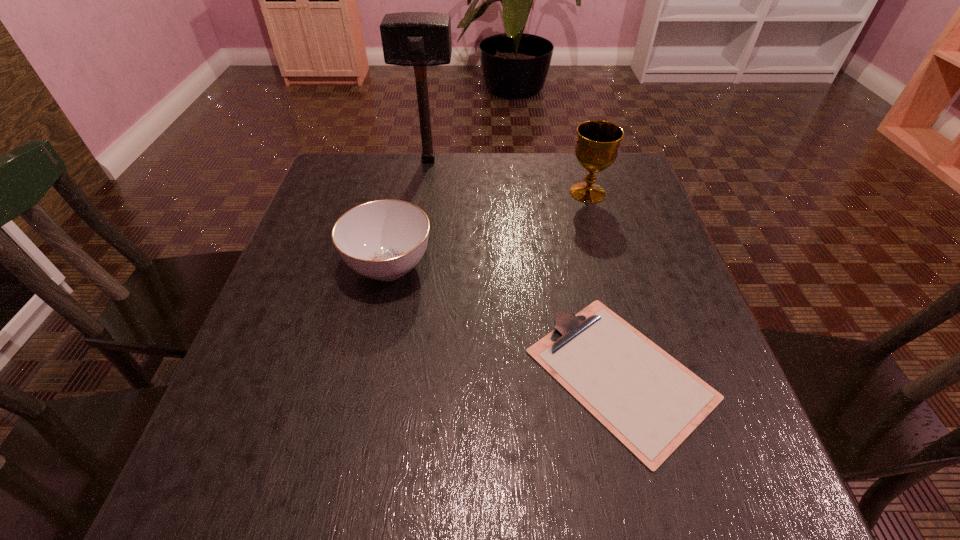
Locate an element on the screen. The height and width of the screenshot is (540, 960). vacant point located 0.070m on the right of the second shortest object is located at coordinates (467, 266).

Where is `free space located on the left of the nearest object`? The width and height of the screenshot is (960, 540). free space located on the left of the nearest object is located at coordinates (319, 374).

Find the location of a particular element. mallet situated at the far edge is located at coordinates (419, 39).

This screenshot has width=960, height=540. I want to click on chalice that is positioned at the far edge, so click(597, 146).

Locate an element on the screen. This screenshot has height=540, width=960. object at the near edge is located at coordinates (650, 402).

Identify the location of object that is positioned at the left edge. (383, 240).

Identify the location of chalice that is positioned at the right edge. (597, 146).

Image resolution: width=960 pixels, height=540 pixels. Find the location of `clipboard at the right edge`. clipboard at the right edge is located at coordinates (650, 402).

Where is `object that is at the far right corner`? The image size is (960, 540). object that is at the far right corner is located at coordinates 597,146.

At what (x,y) coordinates should I click in order to perform the action: click on object that is positioned at the near right corner. Please return your answer as a coordinate pair (x, y). The image size is (960, 540). Looking at the image, I should click on (650, 402).